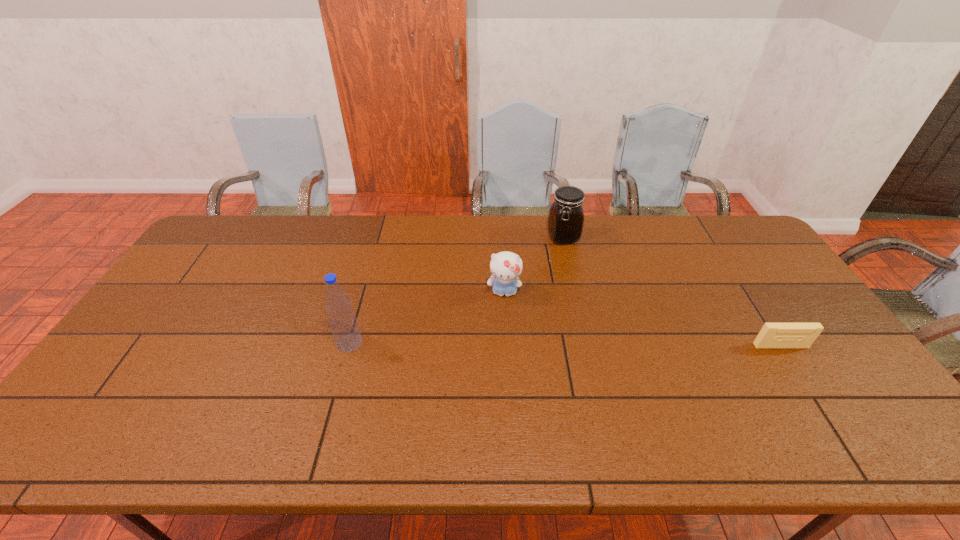
Find the location of a particular element. the leftmost object is located at coordinates (343, 323).

Image resolution: width=960 pixels, height=540 pixels. I want to click on water bottle, so click(x=343, y=323).

What are the coordinates of `videotape` in the screenshot? It's located at (772, 335).

Identify the location of the shortest object. pyautogui.click(x=772, y=335).

This screenshot has height=540, width=960. Find the location of `the farthest object`. the farthest object is located at coordinates (566, 216).

Locate an element on the screen. Image resolution: width=960 pixels, height=540 pixels. the second object from right to left is located at coordinates (566, 216).

This screenshot has height=540, width=960. Identify the location of the third nearest object. (506, 267).

Locate an element on the screen. the second object from left to right is located at coordinates (506, 267).

You are a GUI agent. You are given a task and a screenshot of the screen. Output one action in this format:
    pyautogui.click(x=<x>, y=<y>)
    Task: Click on the free spot located 0.230m on the back of the water bottle
    
    Given the screenshot: What is the action you would take?
    tap(368, 278)

The image size is (960, 540). I want to click on free space located 0.070m at the front of the rightmost object with spools, so click(x=797, y=371).